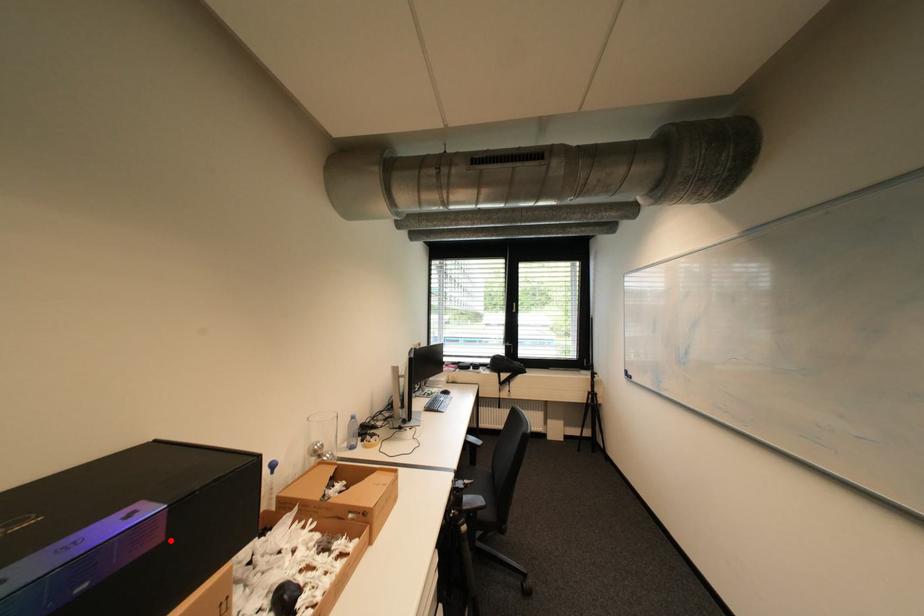
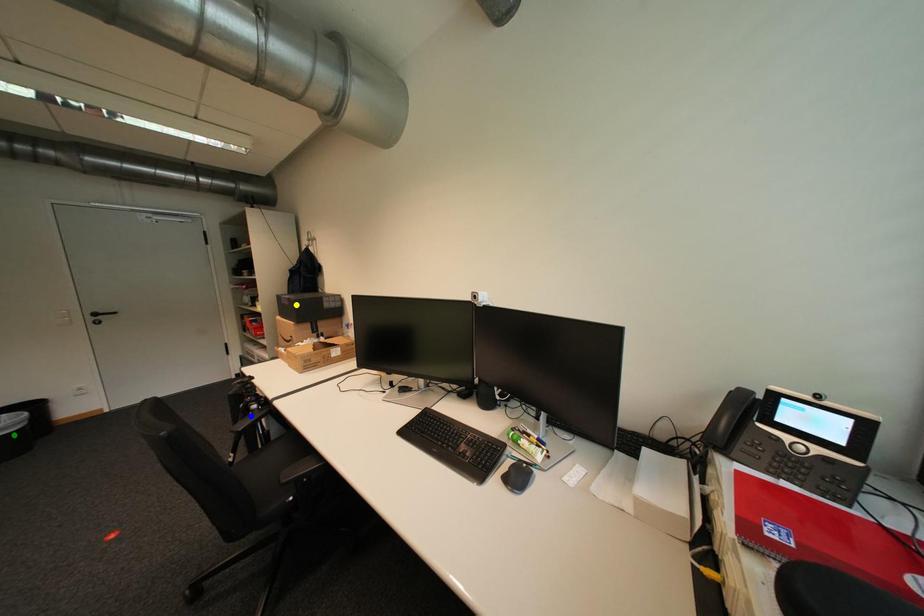
Question: I am providing you with two images of the same scene from different viewpoints. A red point is marked on the first image. You are given multiple points on the second image. Which spot in image 2 lines up with the point in image 1?

Choices:
 (A) blue point
 (B) yellow point
 (C) green point

Answer: (B)